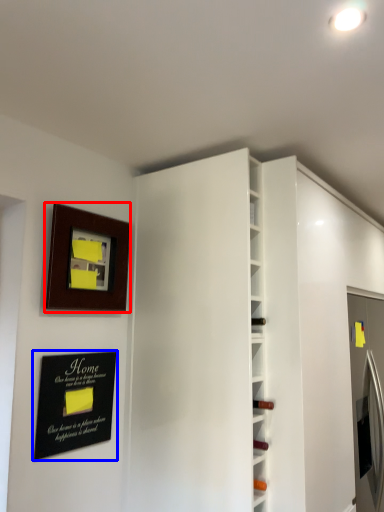
Question: Which object is closer to the camera taking this photo, picture frame (highlighted by a red box) or plaque (highlighted by a blue box)?

Choices:
 (A) picture frame
 (B) plaque

Answer: (B)